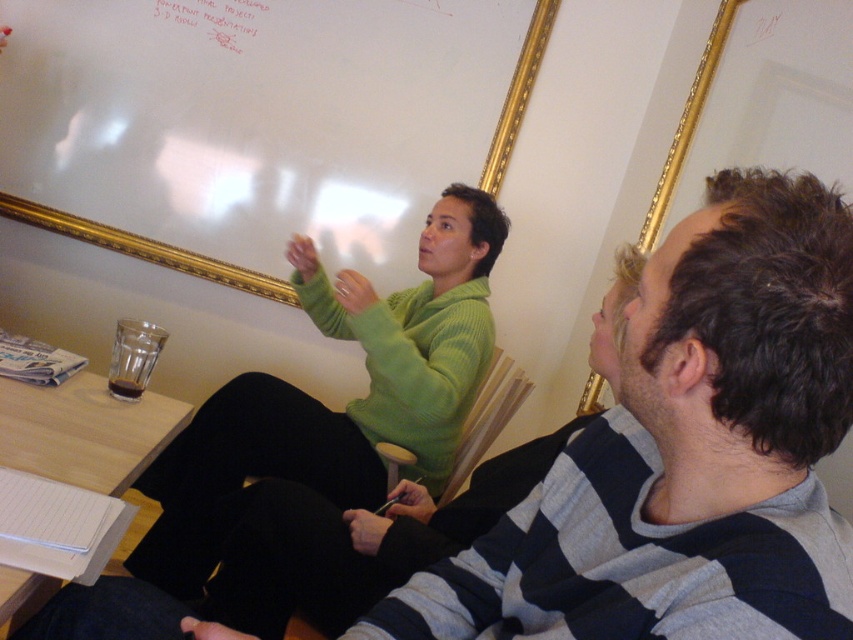
Question: Can you confirm if whiteboard at upper left is thinner than white paper at upper center?

Choices:
 (A) yes
 (B) no

Answer: (B)

Question: Which of the following is the farthest from the observer?

Choices:
 (A) white paper at upper center
 (B) whiteboard at upper left

Answer: (B)

Question: Observing the image, what is the correct spatial positioning of whiteboard at upper left in reference to white paper at upper center?

Choices:
 (A) right
 (B) left

Answer: (B)

Question: Which object appears farthest from the camera in this image?

Choices:
 (A) white paper at upper center
 (B) whiteboard at upper left

Answer: (B)

Question: Can you confirm if whiteboard at upper left is bigger than white paper at upper center?

Choices:
 (A) no
 (B) yes

Answer: (B)